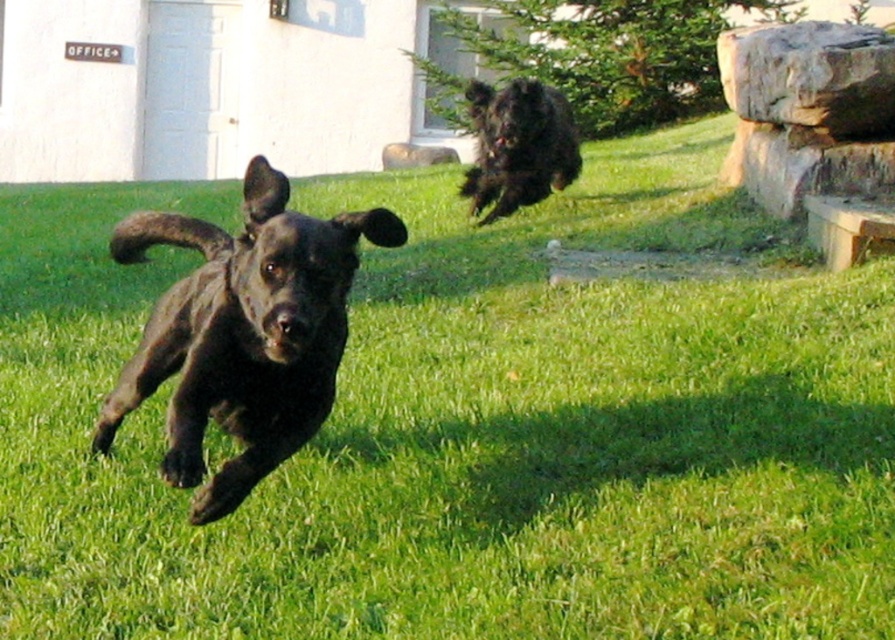
Question: Does shiny black dog at center appear under shaggy black dog at upper right?

Choices:
 (A) no
 (B) yes

Answer: (B)

Question: Does shiny black dog at center have a larger size compared to shaggy black dog at upper right?

Choices:
 (A) no
 (B) yes

Answer: (B)

Question: Which point is farther from the camera taking this photo?

Choices:
 (A) (333, 296)
 (B) (521, 161)

Answer: (B)

Question: Among these points, which one is nearest to the camera?

Choices:
 (A) (301, 296)
 (B) (561, 140)

Answer: (A)

Question: Which point appears closest to the camera in this image?

Choices:
 (A) (155, 344)
 (B) (555, 129)

Answer: (A)

Question: Is shiny black dog at center to the right of shaggy black dog at upper right from the viewer's perspective?

Choices:
 (A) yes
 (B) no

Answer: (B)